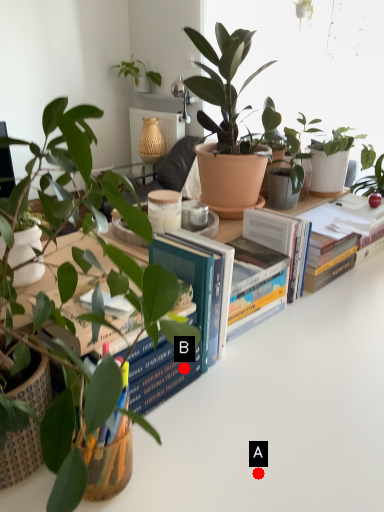
Question: Two points are circled on the image, labeled by A and B beside each circle. Which point is closer to the camera?

Choices:
 (A) A is closer
 (B) B is closer

Answer: (A)